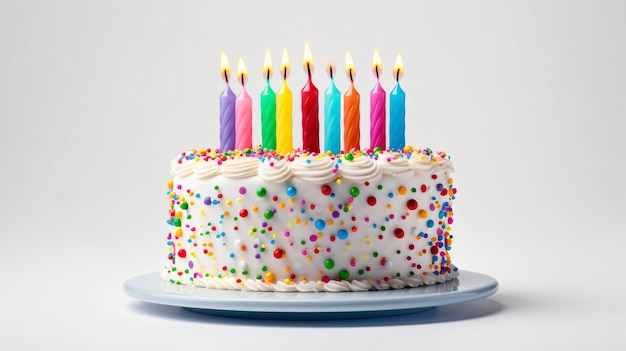
The width and height of the screenshot is (626, 351). I want to click on birthday cake candles, so click(x=225, y=118), click(x=237, y=124), click(x=263, y=118), click(x=280, y=120), click(x=305, y=111), click(x=330, y=123), click(x=352, y=121), click(x=377, y=118), click(x=399, y=119).